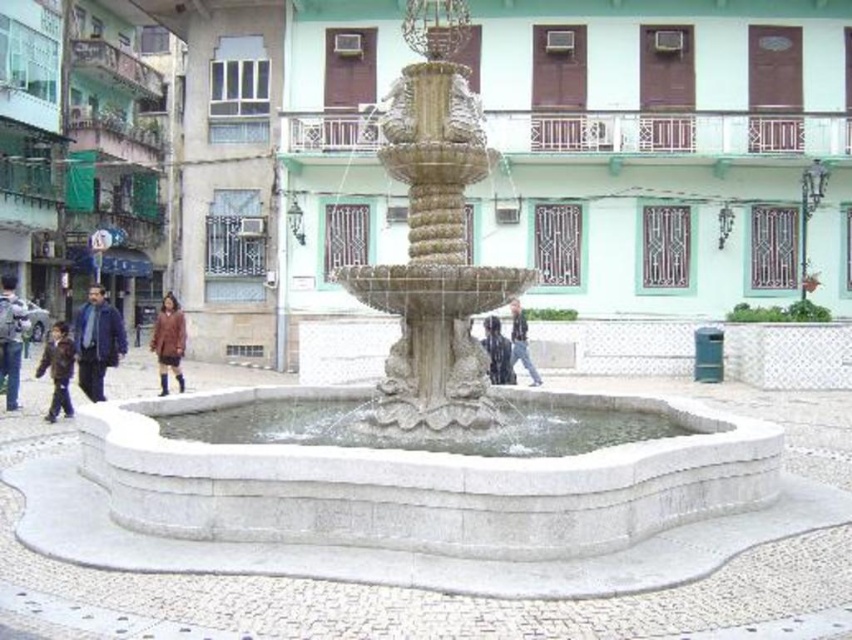
Question: Which point appears farthest from the camera in this image?

Choices:
 (A) pos(91,333)
 (B) pos(504,364)
 (C) pos(16,408)

Answer: (B)

Question: Is dark brown leather jacket at left positioned before dark brown leather jacket at center?

Choices:
 (A) yes
 (B) no

Answer: (A)

Question: Which object appears closest to the camera in this image?

Choices:
 (A) dark blue jacket at left
 (B) brown leather coat at lower left
 (C) dark blue jeans at center
 (D) brown leather jacket at lower left

Answer: (D)

Question: Does dark blue jacket at left have a greater width compared to brown leather coat at lower left?

Choices:
 (A) yes
 (B) no

Answer: (A)

Question: Is dark blue jacket at left smaller than dark brown leather jacket at left?

Choices:
 (A) no
 (B) yes

Answer: (A)

Question: Which of the following is the closest to the observer?

Choices:
 (A) (79, 371)
 (B) (50, 404)
 (C) (163, 371)

Answer: (B)